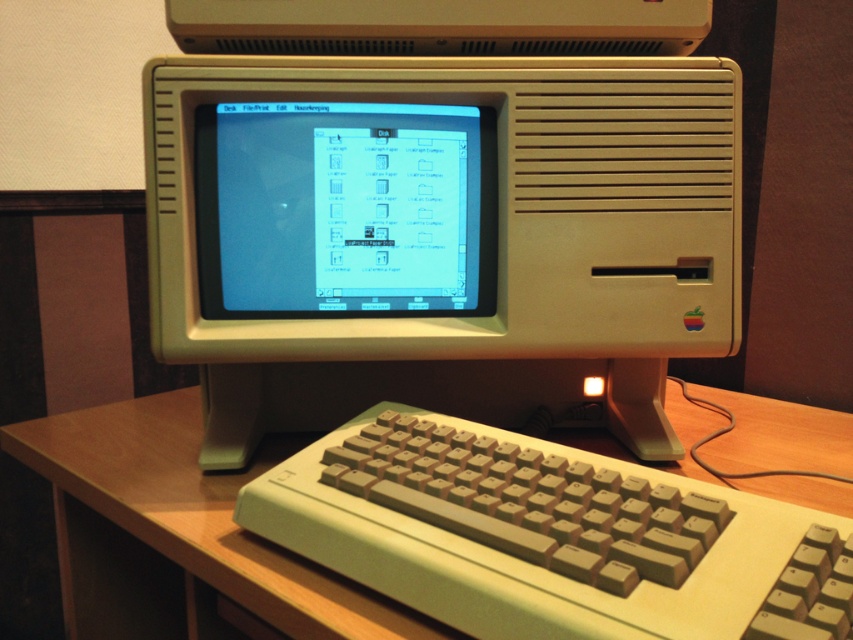
You are a technician trying to fix the beige plastic desktop computer at center and the wooden at center. Which one is closer to you?

The beige plastic desktop computer at center is closer to you than the wooden at center.

You are setting up a vintage Apple computer from the 1980s. The beige plastic desktop computer at center has a keyboard that needs to be placed exactly 2 inches away from the matte plastic screen at center. Can you position the keyboard correctly based on the current setup?

The distance between the beige plastic desktop computer at center and the matte plastic screen at center is 1.83 inches. Since the required distance is 2 inches, the keyboard needs to be moved slightly further away from the screen to meet the requirement.

Looking at this image, you are setting up a vintage Apple computer display. You have a wooden at center and a matte plastic screen at center. Which object is positioned lower in the setup?

The wooden at center is positioned lower than the matte plastic screen at center in the setup.